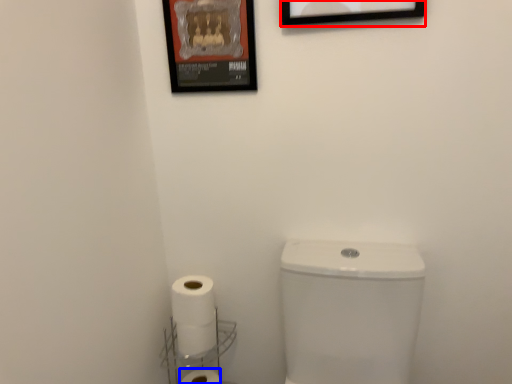
Question: Which point is further to the camera, picture frame (highlighted by a red box) or toilet paper (highlighted by a blue box)?

Choices:
 (A) picture frame
 (B) toilet paper

Answer: (B)